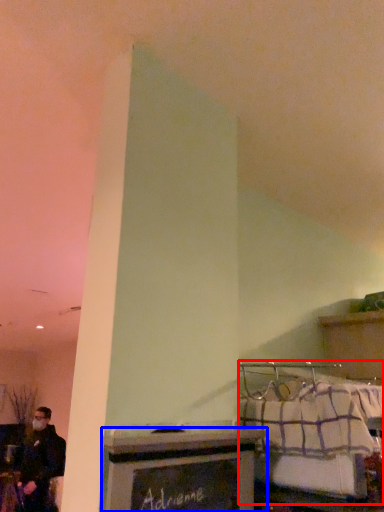
Question: Which of the following is the closest to the observer, bed (highlighted by a red box) or furniture (highlighted by a blue box)?

Choices:
 (A) bed
 (B) furniture

Answer: (B)